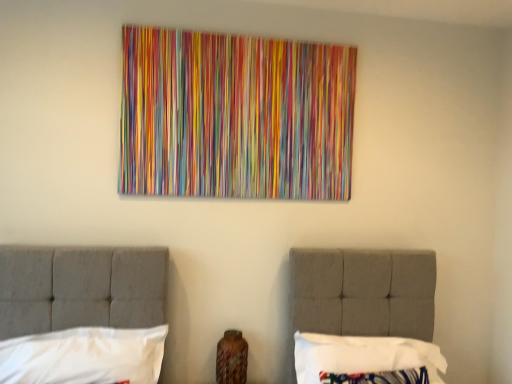
Question: From the image's perspective, is white fabric pillow at lower right, which is counted as the first pillow, starting from the right, above or below white fabric pillow at lower left, placed as the 1th pillow when sorted from left to right?

Choices:
 (A) below
 (B) above

Answer: (A)

Question: Is point (308, 347) positioned closer to the camera than point (123, 342)?

Choices:
 (A) closer
 (B) farther

Answer: (B)

Question: From their relative heights in the image, would you say white fabric pillow at lower right, which is counted as the first pillow, starting from the right, is taller or shorter than white fabric pillow at lower left, placed as the 1th pillow when sorted from left to right?

Choices:
 (A) short
 (B) tall

Answer: (B)

Question: Is white fabric pillow at lower left, placed as the 1th pillow when sorted from left to right, to the left or to the right of white fabric pillow at lower right, placed as the second pillow when sorted from left to right, in the image?

Choices:
 (A) left
 (B) right

Answer: (A)

Question: Considering the positions of white fabric pillow at lower left, which is counted as the 2th pillow, starting from the right, and white fabric pillow at lower right, which is counted as the first pillow, starting from the right, in the image, is white fabric pillow at lower left, which is counted as the 2th pillow, starting from the right, bigger or smaller than white fabric pillow at lower right, which is counted as the first pillow, starting from the right,?

Choices:
 (A) small
 (B) big

Answer: (A)

Question: Relative to white fabric pillow at lower right, which is counted as the first pillow, starting from the right, is white fabric pillow at lower left, which is counted as the 2th pillow, starting from the right, in front or behind?

Choices:
 (A) front
 (B) behind

Answer: (A)

Question: Is white fabric pillow at lower left, which is counted as the 2th pillow, starting from the right, inside or outside of white fabric pillow at lower right, which is counted as the first pillow, starting from the right?

Choices:
 (A) inside
 (B) outside

Answer: (B)